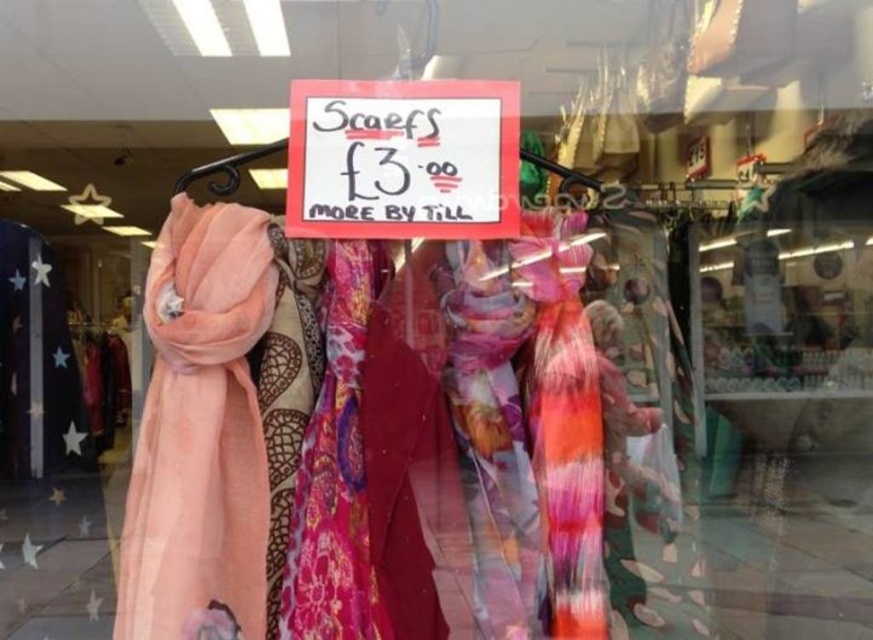
Which of these two, white paper sign at center or multicolored silky scarf at center, stands taller?

multicolored silky scarf at center is taller.

Is white paper sign at center above multicolored silky scarf at center?

Yes, white paper sign at center is above multicolored silky scarf at center.

Find the location of `white paper sign at center`. white paper sign at center is located at coordinates (402, 160).

Can you confirm if multicolored silky scarf at center is positioned below pink floral scarf at center?

Actually, multicolored silky scarf at center is above pink floral scarf at center.

Does multicolored silky scarf at center come behind pink floral scarf at center?

Yes.

What do you see at coordinates (564, 419) in the screenshot? I see `multicolored silky scarf at center` at bounding box center [564, 419].

Identify the location of multicolored silky scarf at center. (564, 419).

Does peach silky scarf at left lie in front of multicolored silky scarf at center?

Yes, peach silky scarf at left is closer to the viewer.

Can you confirm if peach silky scarf at left is thinner than multicolored silky scarf at center?

No.

Is point (119, 600) positioned in front of point (559, 344)?

That is True.

Locate an element on the screen. peach silky scarf at left is located at coordinates (200, 435).